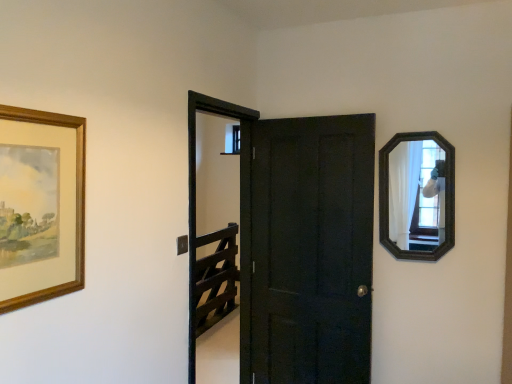
Question: Is wooden picture frame at left smaller than black wooden screen door at center?

Choices:
 (A) yes
 (B) no

Answer: (A)

Question: Is wooden picture frame at left at the left side of black wooden screen door at center?

Choices:
 (A) yes
 (B) no

Answer: (A)

Question: Does wooden picture frame at left touch black wooden screen door at center?

Choices:
 (A) no
 (B) yes

Answer: (A)

Question: Is wooden picture frame at left outside black wooden screen door at center?

Choices:
 (A) no
 (B) yes

Answer: (B)

Question: From a real-world perspective, is wooden picture frame at left physically below black wooden screen door at center?

Choices:
 (A) yes
 (B) no

Answer: (B)

Question: In terms of height, does wooden-framed mirror at upper right look taller or shorter compared to black wooden screen door at center?

Choices:
 (A) tall
 (B) short

Answer: (B)

Question: Is wooden-framed mirror at upper right spatially inside black wooden screen door at center, or outside of it?

Choices:
 (A) inside
 (B) outside

Answer: (B)

Question: Is wooden-framed mirror at upper right to the left or to the right of black wooden screen door at center in the image?

Choices:
 (A) right
 (B) left

Answer: (A)

Question: From a real-world perspective, relative to black wooden screen door at center, is wooden-framed mirror at upper right vertically above or below?

Choices:
 (A) below
 (B) above

Answer: (B)

Question: In the image, is wooden picture frame at left on the left side or the right side of wooden-framed mirror at upper right?

Choices:
 (A) left
 (B) right

Answer: (A)

Question: Considering the positions of point (81, 196) and point (436, 190), is point (81, 196) closer or farther from the camera than point (436, 190)?

Choices:
 (A) farther
 (B) closer

Answer: (B)

Question: Considering their positions, is wooden picture frame at left located in front of or behind wooden-framed mirror at upper right?

Choices:
 (A) front
 (B) behind

Answer: (A)

Question: Looking at the image, does wooden picture frame at left seem bigger or smaller compared to wooden-framed mirror at upper right?

Choices:
 (A) small
 (B) big

Answer: (A)

Question: In terms of height, does black wooden screen door at center look taller or shorter compared to wooden picture frame at left?

Choices:
 (A) tall
 (B) short

Answer: (A)

Question: Is black wooden screen door at center situated inside wooden picture frame at left or outside?

Choices:
 (A) inside
 (B) outside

Answer: (B)